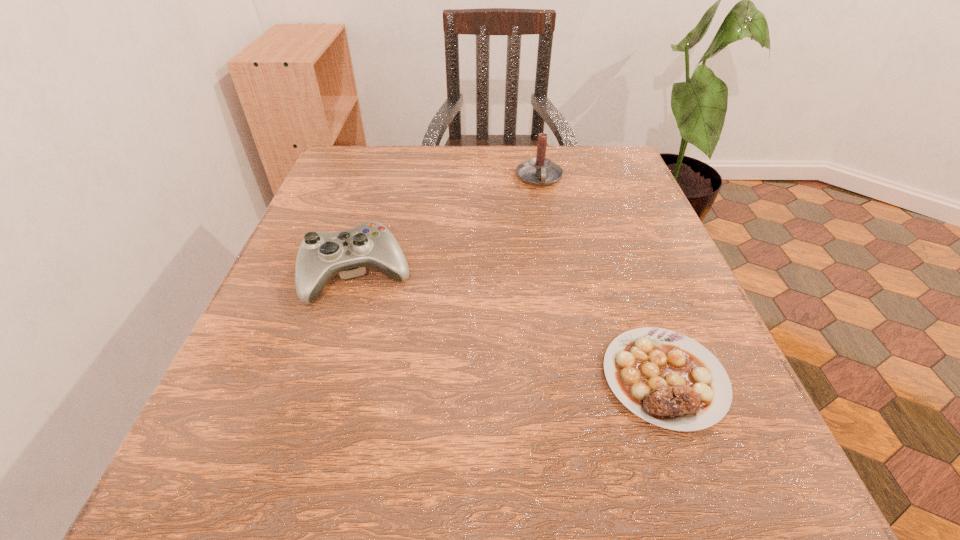
Identify the location of the closest object to the shortest object. (321, 255).

You are a GUI agent. You are given a task and a screenshot of the screen. Output one action in this format:
    pyautogui.click(x=<x>, y=<y>)
    Task: Click on the object identified as the second closest to the second shortest object
    The width and height of the screenshot is (960, 540).
    Given the screenshot: What is the action you would take?
    pyautogui.click(x=664, y=377)

Where is `vacant space that satisfies the following two spatial constraints: 1. on the front side of the second nearest object; 2. on the left side of the shortest object`? vacant space that satisfies the following two spatial constraints: 1. on the front side of the second nearest object; 2. on the left side of the shortest object is located at coordinates (328, 378).

Locate an element on the screen. The height and width of the screenshot is (540, 960). free region that satisfies the following two spatial constraints: 1. on the side of the farthest object with the handle loop; 2. on the right side of the steak is located at coordinates (577, 378).

At what (x,y) coordinates should I click in order to perform the action: click on free space that satisfies the following two spatial constraints: 1. on the side of the nearest object with the handle loop; 2. on the left side of the candle. Please return your answer as a coordinate pair (x, y). Looking at the image, I should click on coord(577,378).